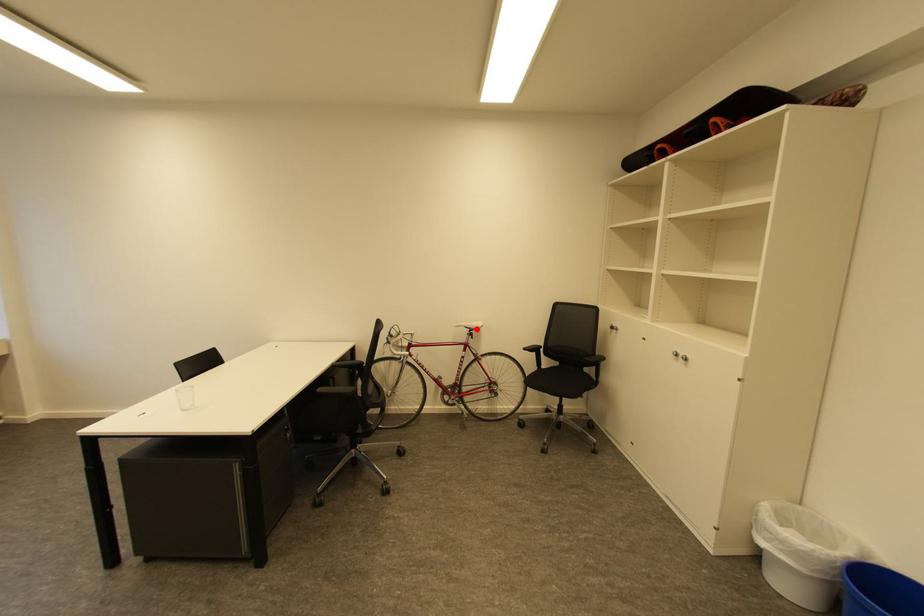
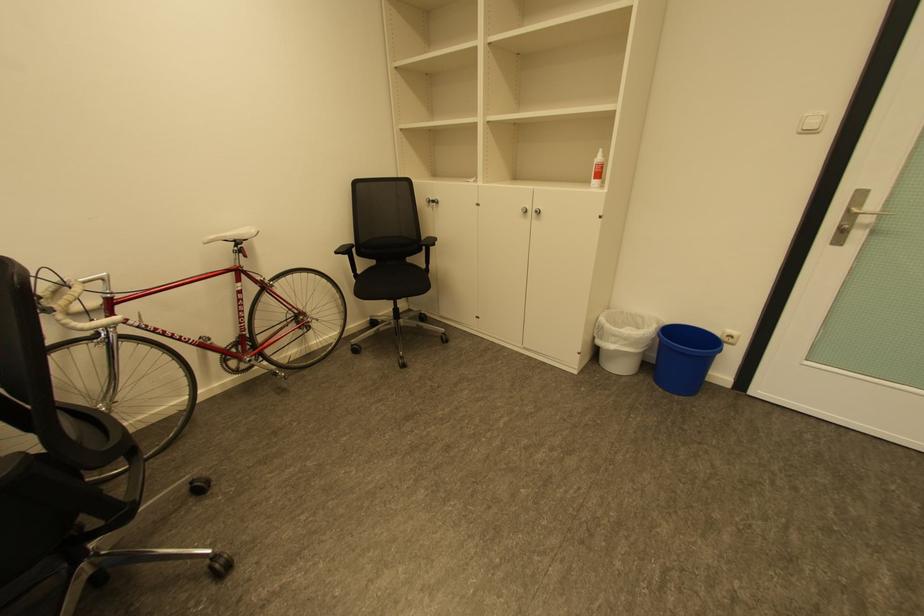
In the second image, find the point that corresponds to the highlighted location in the first image.

(241, 241)